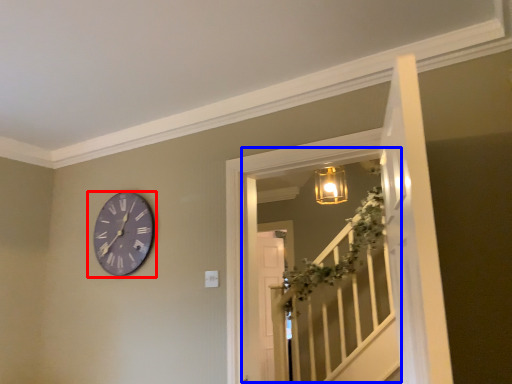
Question: Which of the following is the farthest to the observer, wall clock (highlighted by a red box) or window (highlighted by a blue box)?

Choices:
 (A) wall clock
 (B) window

Answer: (A)